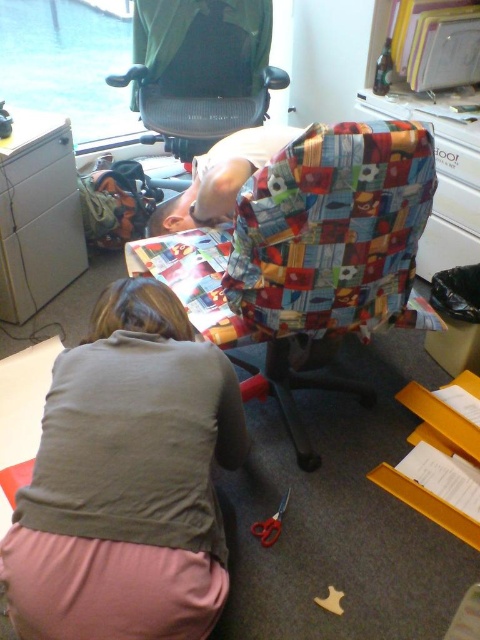
Question: Which of the following is the closest to the observer?

Choices:
 (A) light brown fabric shirt at lower left
 (B) metallic gray filing cabinet at left

Answer: (A)

Question: Can you confirm if green fabric swivel chair at upper center is thinner than metallic gray filing cabinet at left?

Choices:
 (A) no
 (B) yes

Answer: (A)

Question: Which object is the farthest from the pink fabric at lower left?

Choices:
 (A) light brown fabric shirt at lower left
 (B) green fabric swivel chair at upper center

Answer: (B)

Question: Estimate the real-world distances between objects in this image. Which object is farther from the pink fabric at lower left?

Choices:
 (A) metallic gray filing cabinet at left
 (B) green fabric swivel chair at upper center

Answer: (B)

Question: Can you confirm if light brown fabric shirt at lower left is wider than metallic gray filing cabinet at left?

Choices:
 (A) no
 (B) yes

Answer: (B)

Question: Can you confirm if light brown fabric shirt at lower left is positioned below green fabric swivel chair at upper center?

Choices:
 (A) yes
 (B) no

Answer: (A)